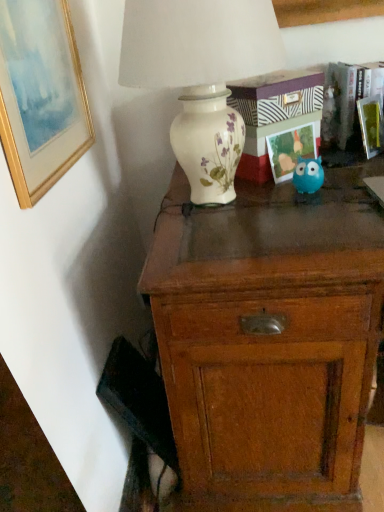
Question: From the image's perspective, is matte plastic picture frame at upper right, acting as the second picture frame starting from the left, located beneath gold-framed painting at upper left, which is counted as the 1th picture frame, starting from the left?

Choices:
 (A) yes
 (B) no

Answer: (A)

Question: Is matte plastic picture frame at upper right, marked as the 2th picture frame in a right-to-left arrangement, far from gold-framed painting at upper left, which is counted as the 1th picture frame, starting from the left?

Choices:
 (A) yes
 (B) no

Answer: (B)

Question: Considering the relative sizes of matte plastic picture frame at upper right, acting as the second picture frame starting from the left, and gold-framed painting at upper left, which is counted as the 1th picture frame, starting from the left, in the image provided, is matte plastic picture frame at upper right, acting as the second picture frame starting from the left, wider than gold-framed painting at upper left, which is counted as the 1th picture frame, starting from the left,?

Choices:
 (A) yes
 (B) no

Answer: (A)

Question: Is the position of matte plastic picture frame at upper right, marked as the 2th picture frame in a right-to-left arrangement, less distant than that of gold-framed painting at upper left, marked as the third picture frame in a right-to-left arrangement?

Choices:
 (A) yes
 (B) no

Answer: (B)

Question: Is matte plastic picture frame at upper right, marked as the 2th picture frame in a right-to-left arrangement, next to gold-framed painting at upper left, which is counted as the 1th picture frame, starting from the left?

Choices:
 (A) yes
 (B) no

Answer: (B)

Question: Is white ceramic vase at upper center inside or outside of blue rubber toy at center?

Choices:
 (A) inside
 (B) outside

Answer: (B)

Question: Considering their positions, is white ceramic vase at upper center located in front of or behind blue rubber toy at center?

Choices:
 (A) front
 (B) behind

Answer: (A)

Question: From a real-world perspective, is white ceramic vase at upper center physically located above or below blue rubber toy at center?

Choices:
 (A) below
 (B) above

Answer: (B)

Question: Considering the positions of white ceramic vase at upper center and blue rubber toy at center in the image, is white ceramic vase at upper center bigger or smaller than blue rubber toy at center?

Choices:
 (A) big
 (B) small

Answer: (A)

Question: Considering the positions of green matte picture frame at upper right, the 1th picture frame viewed from the right, and matte plastic picture frame at upper right, marked as the 2th picture frame in a right-to-left arrangement, in the image, is green matte picture frame at upper right, the 1th picture frame viewed from the right, wider or thinner than matte plastic picture frame at upper right, marked as the 2th picture frame in a right-to-left arrangement,?

Choices:
 (A) thin
 (B) wide

Answer: (B)

Question: From a real-world perspective, is green matte picture frame at upper right, the 1th picture frame viewed from the right, physically located above or below matte plastic picture frame at upper right, marked as the 2th picture frame in a right-to-left arrangement?

Choices:
 (A) above
 (B) below

Answer: (A)

Question: Is green matte picture frame at upper right, the 1th picture frame viewed from the right, spatially inside matte plastic picture frame at upper right, acting as the second picture frame starting from the left, or outside of it?

Choices:
 (A) inside
 (B) outside

Answer: (B)

Question: Is point (369, 117) positioned closer to the camera than point (307, 134)?

Choices:
 (A) farther
 (B) closer

Answer: (A)

Question: From the image's perspective, is wooden chest of drawers at center above or below white ceramic vase at upper center?

Choices:
 (A) below
 (B) above

Answer: (A)

Question: Do you think wooden chest of drawers at center is within white ceramic vase at upper center, or outside of it?

Choices:
 (A) outside
 (B) inside

Answer: (A)